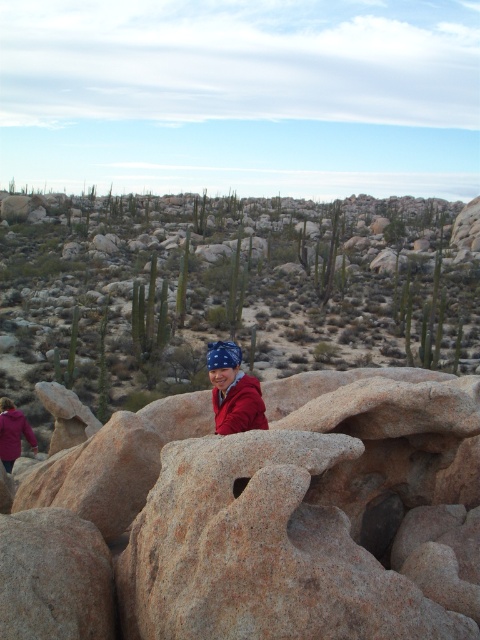
Is point (274, 600) more distant than point (8, 449)?

No, it is not.

The height and width of the screenshot is (640, 480). I want to click on brown rough rock at center, so click(248, 518).

Is matte red jacket at center to the right of matte red jacket at lower left from the viewer's perspective?

Indeed, matte red jacket at center is positioned on the right side of matte red jacket at lower left.

The height and width of the screenshot is (640, 480). Find the location of `matte red jacket at center`. matte red jacket at center is located at coordinates (233, 390).

This screenshot has height=640, width=480. In order to click on matte red jacket at center in this screenshot , I will do `click(233, 390)`.

Does brown rough rock at center have a greater width compared to matte red jacket at center?

Indeed, brown rough rock at center has a greater width compared to matte red jacket at center.

The image size is (480, 640). Identify the location of brown rough rock at center. (248, 518).